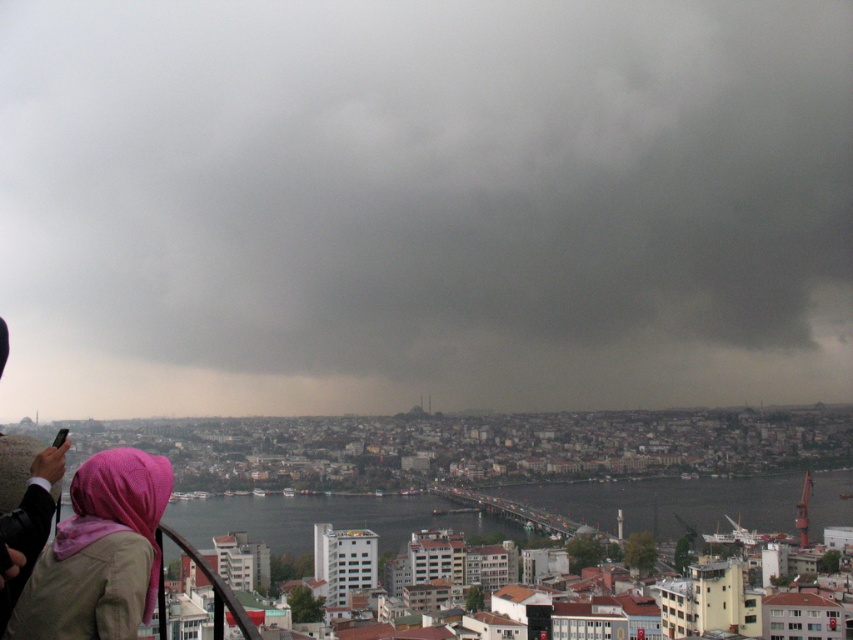
You are a photographer trying to capture the pink fabric headscarf at lower left and the dark gray cloud at upper center in the same frame. Based on their positions, which object would appear larger in the photo?

The dark gray cloud at upper center is much taller than the pink fabric headscarf at lower left, so it would appear larger in the photo.

You are a photographer trying to capture the pink fabric headscarf at lower left and the dark gray cloud at upper center in a single frame. Based on their sizes, which object would appear larger in the photo?

The dark gray cloud at upper center would appear larger in the photo because its width is larger than the pink fabric headscarf at lower left.